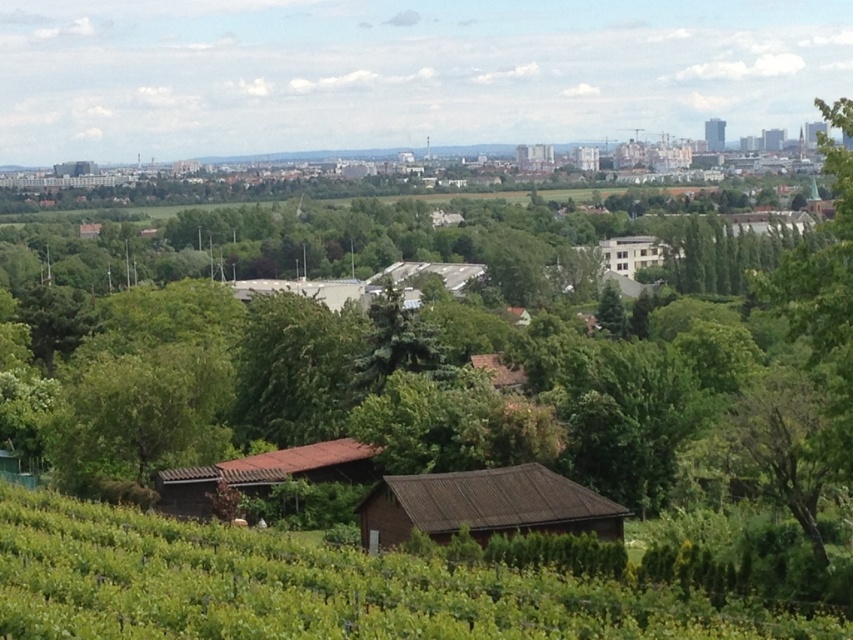
Question: Is brown wooden hut at lower left further to the viewer compared to gray metallic building at center?

Choices:
 (A) yes
 (B) no

Answer: (B)

Question: Is brown corrugated roof hut at center to the right of white wooden house at right from the viewer's perspective?

Choices:
 (A) no
 (B) yes

Answer: (A)

Question: Can you confirm if gray metallic building at center is positioned below brown wooden hut at center?

Choices:
 (A) no
 (B) yes

Answer: (A)

Question: Among these objects, which one is farthest from the camera?

Choices:
 (A) white matte building at center
 (B) brown wooden hut at lower left
 (C) brown wooden hut at center

Answer: (A)

Question: Among these points, which one is nearest to the camera?

Choices:
 (A) (265, 467)
 (B) (647, 259)
 (C) (456, 275)

Answer: (A)

Question: Which is farther from the white matte building at center?

Choices:
 (A) gray metallic building at center
 (B) green grassy hillside at lower center

Answer: (B)